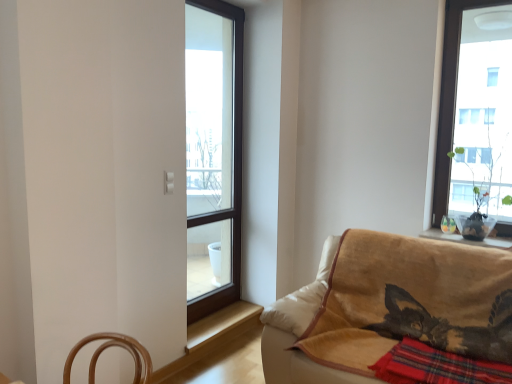
Question: Is wooden at lower center closer to the viewer compared to red plaid blanket at lower right?

Choices:
 (A) yes
 (B) no

Answer: (B)

Question: Does wooden at lower center contain red plaid blanket at lower right?

Choices:
 (A) yes
 (B) no

Answer: (B)

Question: Does wooden at lower center appear on the left side of red plaid blanket at lower right?

Choices:
 (A) yes
 (B) no

Answer: (A)

Question: Does wooden at lower center have a larger size compared to red plaid blanket at lower right?

Choices:
 (A) yes
 (B) no

Answer: (B)

Question: From a real-world perspective, is wooden at lower center physically above red plaid blanket at lower right?

Choices:
 (A) no
 (B) yes

Answer: (A)

Question: Based on their positions, is velvet beige couch at lower right located to the left or right of transparent glass window at center?

Choices:
 (A) right
 (B) left

Answer: (A)

Question: From the image's perspective, relative to transparent glass window at center, is velvet beige couch at lower right above or below?

Choices:
 (A) below
 (B) above

Answer: (A)

Question: In terms of height, does velvet beige couch at lower right look taller or shorter compared to transparent glass window at center?

Choices:
 (A) tall
 (B) short

Answer: (B)

Question: Is velvet beige couch at lower right inside or outside of transparent glass window at center?

Choices:
 (A) outside
 (B) inside

Answer: (A)

Question: Based on their sizes in the image, would you say wooden at lower center is bigger or smaller than transparent glass window at center?

Choices:
 (A) small
 (B) big

Answer: (A)

Question: Considering the positions of wooden at lower center and transparent glass window at center in the image, is wooden at lower center taller or shorter than transparent glass window at center?

Choices:
 (A) short
 (B) tall

Answer: (A)

Question: From the image's perspective, is wooden at lower center above or below transparent glass window at center?

Choices:
 (A) below
 (B) above

Answer: (A)

Question: Does point (245, 317) appear closer or farther from the camera than point (192, 309)?

Choices:
 (A) closer
 (B) farther

Answer: (B)

Question: Looking at their shapes, would you say wooden at lower center is wider or thinner than velvet beige couch at lower right?

Choices:
 (A) wide
 (B) thin

Answer: (B)

Question: Is wooden at lower center spatially inside velvet beige couch at lower right, or outside of it?

Choices:
 (A) outside
 (B) inside

Answer: (A)